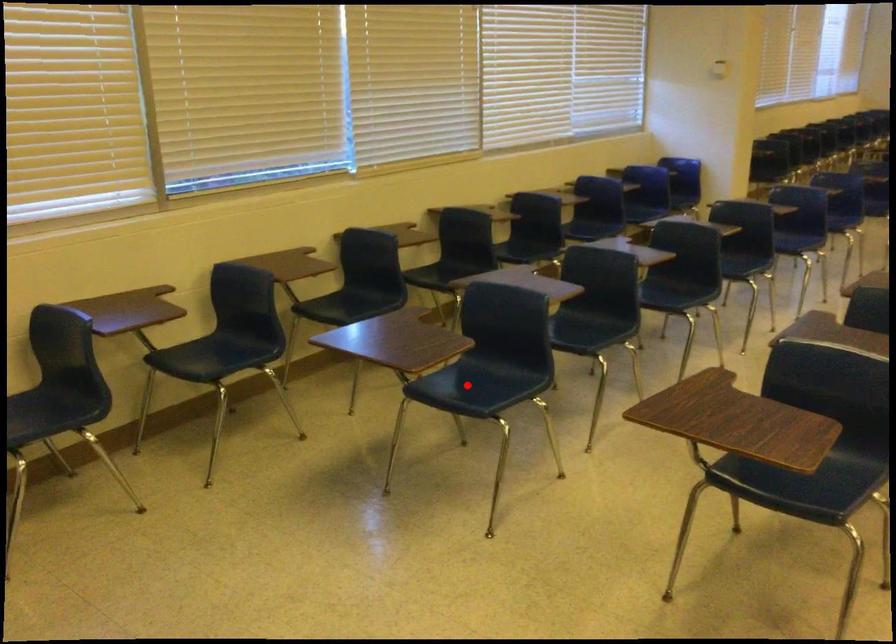
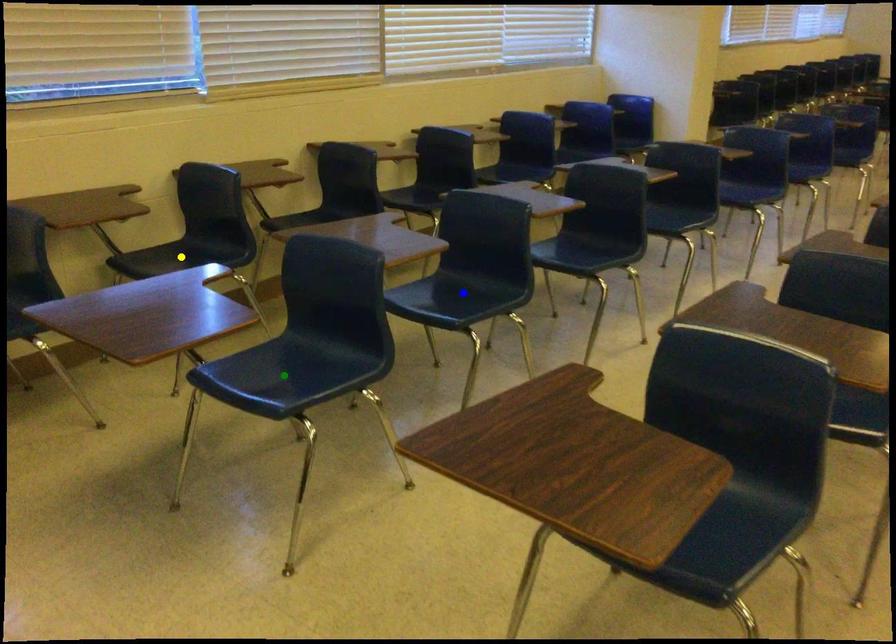
Question: I am providing you with two images of the same scene from different viewpoints. A red point is marked on the first image. You are given multiple points on the second image. Which spot in image 2 lines up with the point in image 1?

Choices:
 (A) green point
 (B) blue point
 (C) yellow point

Answer: (A)